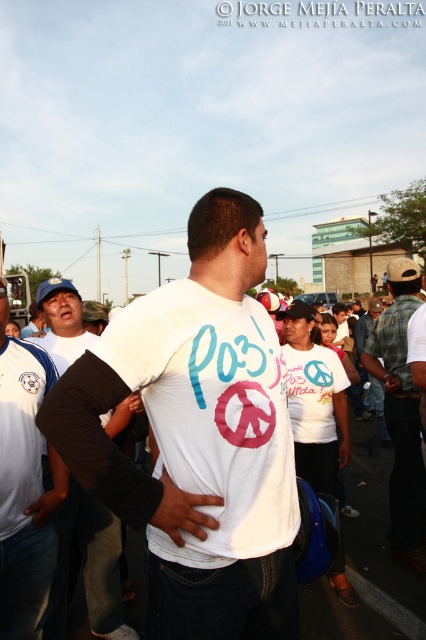
You are a photographer trying to capture the central figure in the image. The central figure is wearing a white T shirt with text and symbols. You want to ensure that the text on the T shirt is clearly visible in your photo. Based on the position of the point at coordinates point (198, 436), which corresponds to the white matte t shirt at center, where should you aim your camera to best capture the text on the T shirt?

The point at coordinates point (198, 436) corresponds to the white matte t shirt at center. To best capture the text on the T shirt, aim your camera directly at this point to ensure the text is centered and in focus.

You are standing at the center of the image and want to know where the point at coordinates point (88,566) is located. Which object does it belong to?

The point at coordinates point (88,566) is located on the black cotton shirt at left.